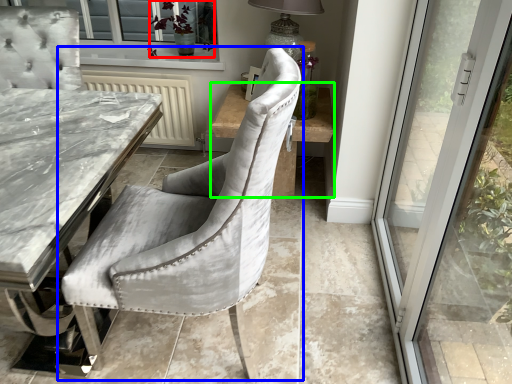
Question: Considering the real-world distances, which object is closest to plant (highlighted by a red box)? chair (highlighted by a blue box) or side table (highlighted by a green box).

Choices:
 (A) chair
 (B) side table

Answer: (B)